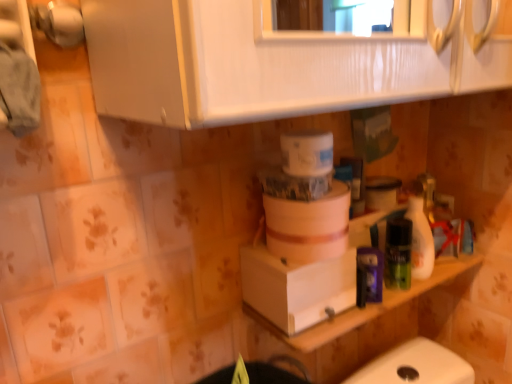
Where is `white matte container at center`? This screenshot has width=512, height=384. white matte container at center is located at coordinates (307, 153).

Find the location of `white matte counter top at lower right`. white matte counter top at lower right is located at coordinates (365, 308).

Measure the distance between white glossy bottle at right and white matte container at center.

white glossy bottle at right and white matte container at center are 30.63 centimeters apart.

Does point (414, 261) come behind point (294, 162)?

Yes, it is.

Considering the sizes of objects white glossy bottle at right and white matte container at center in the image provided, who is smaller, white glossy bottle at right or white matte container at center?

With smaller size is white glossy bottle at right.

Looking at this image, considering their positions, is white glossy bottle at right located in front of or behind white matte container at center?

white glossy bottle at right is positioned farther from the viewer than white matte container at center.

Is white matte counter top at lower right aimed at white cardboard box at center?

No, white matte counter top at lower right is not facing towards white cardboard box at center.

Which object is thinner, white matte counter top at lower right or white cardboard box at center?

white cardboard box at center is thinner.

From their relative heights in the image, would you say white matte counter top at lower right is taller or shorter than white cardboard box at center?

In the image, white matte counter top at lower right appears to be taller than white cardboard box at center.

Is white matte container at center situated inside white matte counter top at lower right or outside?

white matte container at center is spatially situated outside white matte counter top at lower right.

Is there a large distance between white matte container at center and white matte counter top at lower right?

No, white matte container at center is in close proximity to white matte counter top at lower right.

From a real-world perspective, who is located higher, white matte container at center or white matte counter top at lower right?

white matte container at center, from a real-world perspective.

In terms of height, does white matte container at center look taller or shorter compared to white matte counter top at lower right?

Considering their sizes, white matte container at center has less height than white matte counter top at lower right.

In the scene shown: How distant is white cardboard box at center from white glossy bottle at right?

white cardboard box at center and white glossy bottle at right are 10.99 inches apart.

The width and height of the screenshot is (512, 384). Find the location of `cleaning product behind the white cardboard box at center`. cleaning product behind the white cardboard box at center is located at coordinates (419, 232).

Based on the photo, is white cardboard box at center facing away from white glossy bottle at right?

No, white glossy bottle at right is not at the back of white cardboard box at center.

From the image's perspective, is white cardboard box at center above white glossy bottle at right?

Incorrect, from the image's perspective, white cardboard box at center is lower than white glossy bottle at right.

From the image's perspective, which is above, white cardboard box at center or white matte container at center?

white matte container at center appears higher in the image.

From a real-world perspective, is white cardboard box at center located beneath white matte container at center?

Yes, from a real-world perspective, white cardboard box at center is under white matte container at center.

How far apart are white cardboard box at center and white matte container at center?

white cardboard box at center and white matte container at center are 8.43 inches apart.

Is white cardboard box at center situated inside white matte container at center or outside?

white cardboard box at center is spatially situated outside white matte container at center.

How far apart are white glossy bottle at right and white cardboard box at center?

white glossy bottle at right is 27.92 centimeters away from white cardboard box at center.

From a real-world perspective, which is physically above, white glossy bottle at right or white cardboard box at center?

white glossy bottle at right, from a real-world perspective.

Is white glossy bottle at right wider or thinner than white cardboard box at center?

white glossy bottle at right is thinner than white cardboard box at center.

From the picture: Is white glossy bottle at right not near white cardboard box at center?

No, white glossy bottle at right is not far away from white cardboard box at center.

Which of these two, white matte container at center or white cardboard box at center, stands taller?

With more height is white cardboard box at center.

What's the angular difference between white matte container at center and white cardboard box at center's facing directions?

The angle between the facing direction of white matte container at center and the facing direction of white cardboard box at center is 0.00252 degrees.

Based on the photo, can you confirm if white matte container at center is bigger than white cardboard box at center?

No, white matte container at center is not bigger than white cardboard box at center.

Is white matte container at center located outside white cardboard box at center?

That's correct, white matte container at center is outside of white cardboard box at center.

Locate an element on the screen. This screenshot has height=384, width=512. cleaning product below the white matte container at center (from the image's perspective) is located at coordinates (419, 232).

What are the coordinates of `cardboard box lying above the white matte counter top at lower right (from the image's perspective)` in the screenshot? It's located at (296, 287).

From the image, which object appears to be farther from white glossy bottle at right, white matte counter top at lower right or white matte container at center?

The object further to white glossy bottle at right is white matte container at center.

Considering their positions, is white glossy bottle at right positioned closer to white matte container at center than white cardboard box at center?

The object closer to white matte container at center is white cardboard box at center.

Based on their spatial positions, is white glossy bottle at right or white matte counter top at lower right further from white matte container at center?

Among the two, white matte counter top at lower right is located further to white matte container at center.

Based on their spatial positions, is white matte container at center or white cardboard box at center further from white matte counter top at lower right?

The object further to white matte counter top at lower right is white matte container at center.

Estimate the real-world distances between objects in this image. Which object is further from white cardboard box at center, white glossy bottle at right or white matte counter top at lower right?

white glossy bottle at right lies further to white cardboard box at center than the other object.

When comparing their distances from white glossy bottle at right, does white cardboard box at center or white matte counter top at lower right seem further?

white cardboard box at center is positioned further to the anchor white glossy bottle at right.

Looking at the image, which one is located further to white matte container at center, white cardboard box at center or white glossy bottle at right?

white glossy bottle at right lies further to white matte container at center than the other object.

When comparing their distances from white cardboard box at center, does white matte counter top at lower right or white glossy bottle at right seem further?

Based on the image, white glossy bottle at right appears to be further to white cardboard box at center.

At what (x,y) coordinates should I click in order to perform the action: click on cardboard box situated between white matte container at center and white glossy bottle at right from left to right. Please return your answer as a coordinate pair (x, y). The height and width of the screenshot is (384, 512). Looking at the image, I should click on (296, 287).

Identify the location of cleaning product between white matte container at center and white matte counter top at lower right from top to bottom. (419, 232).

You are a GUI agent. You are given a task and a screenshot of the screen. Output one action in this format:
    pyautogui.click(x=<x>, y=<y>)
    Task: Click on the counter top located between white cardboard box at center and white glossy bottle at right in the left-right direction
    The width and height of the screenshot is (512, 384).
    Given the screenshot: What is the action you would take?
    pyautogui.click(x=365, y=308)

Where is `cardboard box between white matte container at center and white matte counter top at lower right in the up-down direction`? cardboard box between white matte container at center and white matte counter top at lower right in the up-down direction is located at coordinates (296, 287).